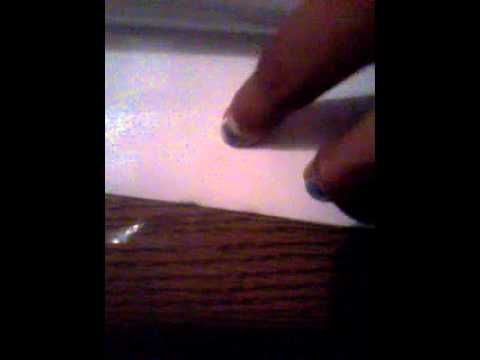
Locate an element on the screen. The image size is (480, 360). dark brown wood grain is located at coordinates (264, 287).